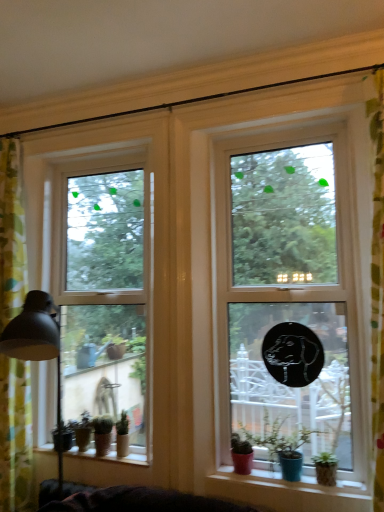
Where is `vacant region above clear glass window at left, which ranks as the second window in right-to-left order (from a real-world perspective)`? vacant region above clear glass window at left, which ranks as the second window in right-to-left order (from a real-world perspective) is located at coordinates (98, 155).